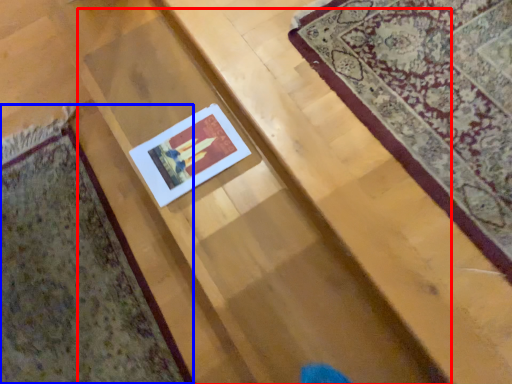
Question: Which of the following is the closest to the observer, stairwell (highlighted by a red box) or mat (highlighted by a blue box)?

Choices:
 (A) stairwell
 (B) mat

Answer: (A)